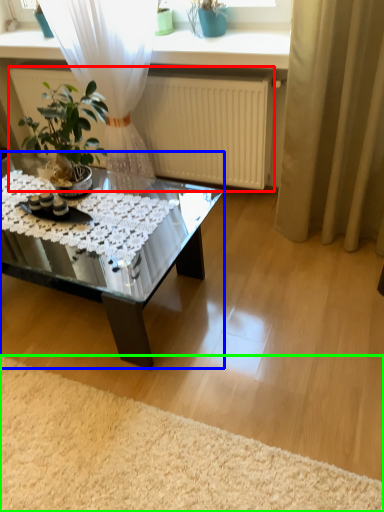
Question: Which object is positioned closest to radiator (highlighted by a red box)? Select from coffee table (highlighted by a blue box) and plain (highlighted by a green box).

Choices:
 (A) coffee table
 (B) plain

Answer: (A)